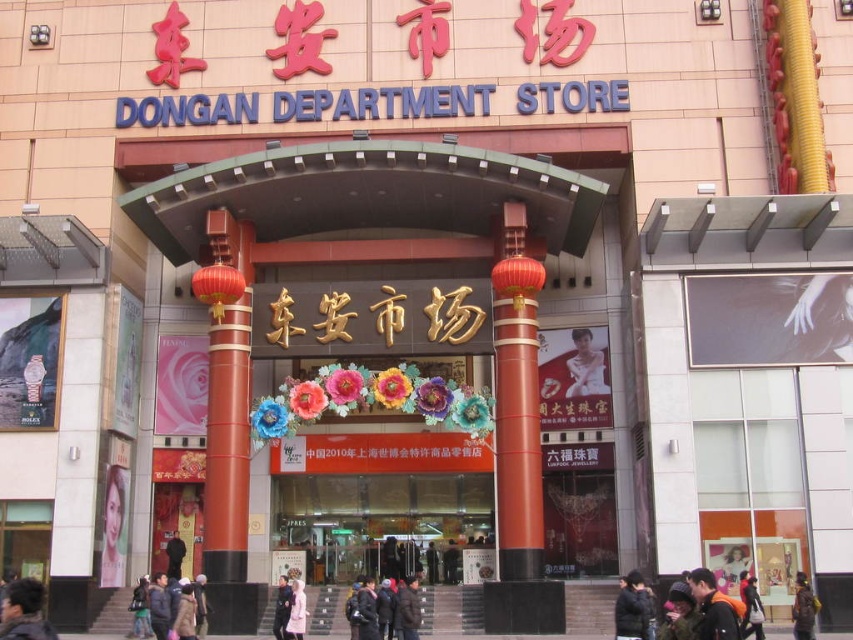
You are a customer entering Dongan Department Store and notice two items displayed at the entrance. The items are the matte gold necklace at center and the dark blue jacket at center. Which item is shorter in height?

The matte gold necklace at center has a lesser height compared to the dark blue jacket at center, so the matte gold necklace at center is shorter.

You are a customer at Dongan Department Store and see two jackets displayed at the entrance. The black matte jacket at lower right and the dark blue jacket at center. Which jacket is placed higher up?

The black matte jacket at lower right is positioned over the dark blue jacket at center, so it is placed higher up.